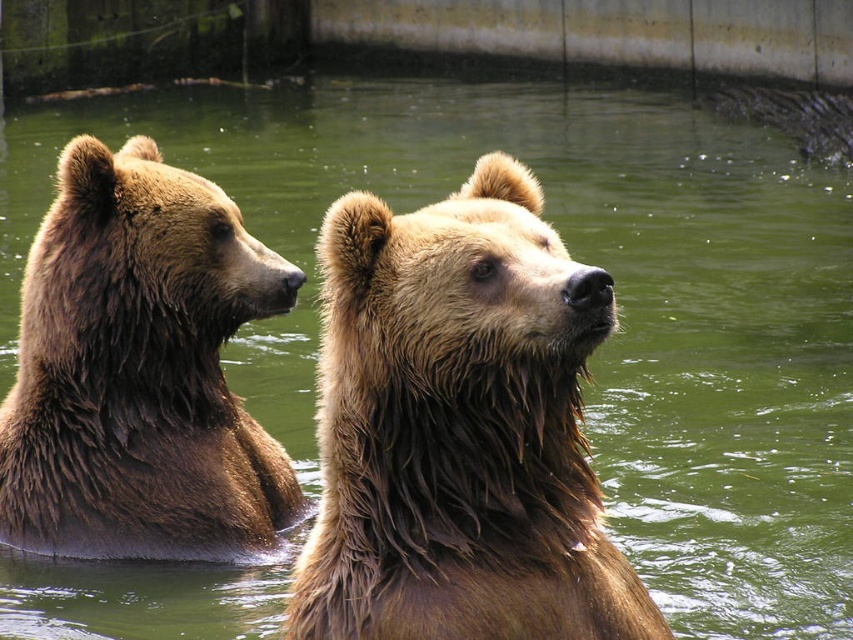
Is the position of wet fur bear at center more distant than that of shaggy brown bear at center?

No, it is in front of shaggy brown bear at center.

Is the position of wet fur bear at center less distant than that of shaggy brown bear at center?

That is True.

Is point (503, 403) positioned after point (163, 493)?

No, it is not.

This screenshot has width=853, height=640. In order to click on wet fur bear at center in this screenshot , I will do `click(459, 428)`.